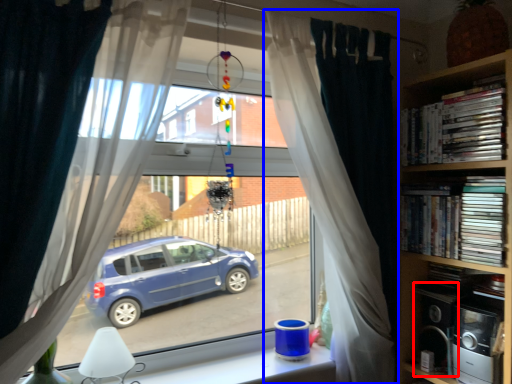
Question: Which object appears closest to the camera in this image, appliance (highlighted by a red box) or curtain (highlighted by a blue box)?

Choices:
 (A) appliance
 (B) curtain

Answer: (B)